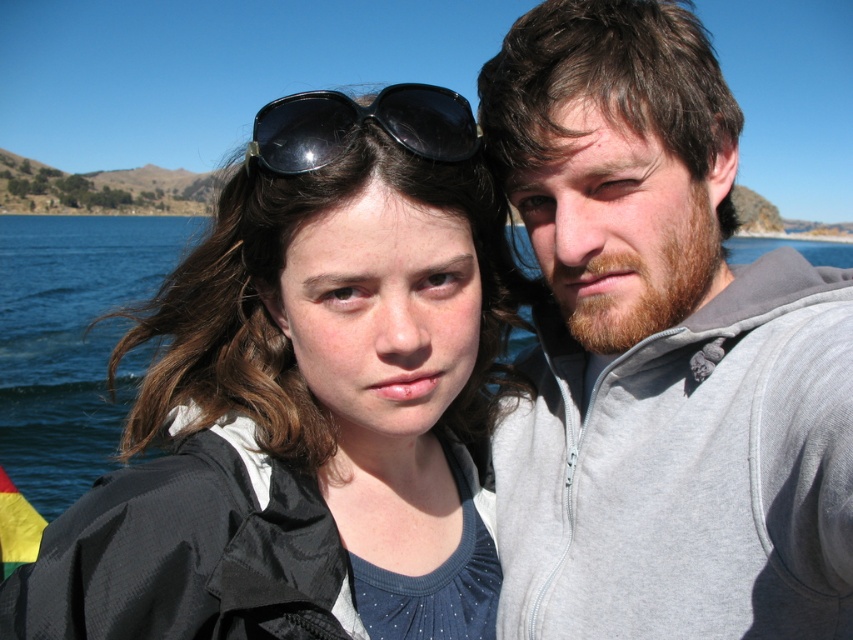
Question: Considering the relative positions of matte black jacket at center and gray zip-up hoodie at center in the image provided, where is matte black jacket at center located with respect to gray zip-up hoodie at center?

Choices:
 (A) below
 (B) above

Answer: (A)

Question: Estimate the real-world distances between objects in this image. Which object is closer to the matte black jacket at center?

Choices:
 (A) gray zip-up hoodie at center
 (B) black reflective sunglasses at center

Answer: (A)

Question: Which point is closer to the camera?

Choices:
 (A) (312, 132)
 (B) (404, 502)
 (C) (747, 294)

Answer: (A)

Question: Among these points, which one is farthest from the camera?

Choices:
 (A) (355, 131)
 (B) (462, 598)

Answer: (B)

Question: Is matte black jacket at center thinner than black reflective sunglasses at center?

Choices:
 (A) no
 (B) yes

Answer: (B)

Question: Is the position of gray zip-up hoodie at center more distant than that of black reflective sunglasses at center?

Choices:
 (A) yes
 (B) no

Answer: (B)